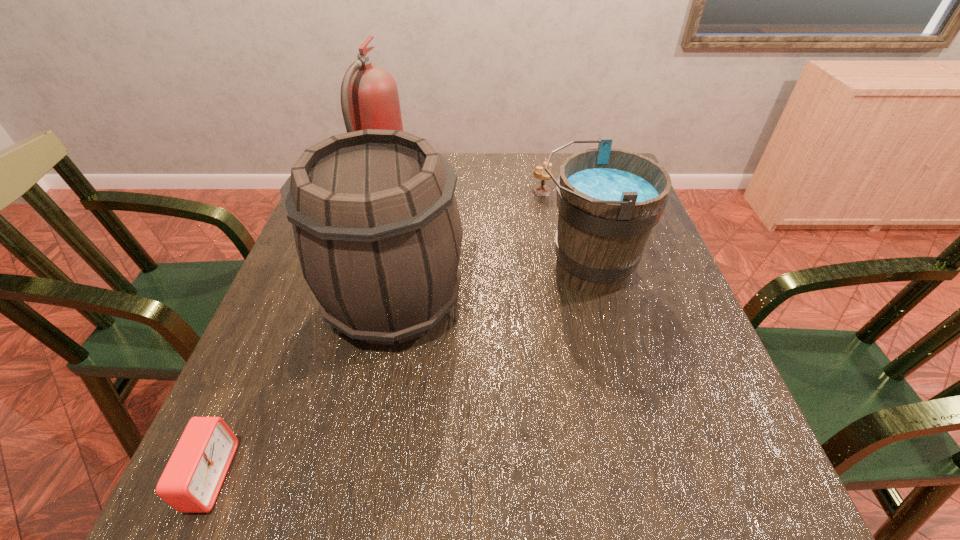
Where is `free space between the taller wine bucket and the shorter wine bucket`? Image resolution: width=960 pixels, height=540 pixels. free space between the taller wine bucket and the shorter wine bucket is located at coordinates (491, 285).

Image resolution: width=960 pixels, height=540 pixels. I want to click on vacant area between the fourth tallest object and the taller wine bucket, so click(468, 246).

Locate an element on the screen. The height and width of the screenshot is (540, 960). free point between the alarm clock and the fire extinguisher is located at coordinates (297, 332).

You are a GUI agent. You are given a task and a screenshot of the screen. Output one action in this format:
    pyautogui.click(x=<x>, y=<y>)
    Task: Click on the free area in between the right wine bucket and the alarm clock
    This screenshot has height=540, width=960.
    Given the screenshot: What is the action you would take?
    pyautogui.click(x=398, y=373)

Where is `free space between the leftmost object and the left wine bucket`? This screenshot has width=960, height=540. free space between the leftmost object and the left wine bucket is located at coordinates (302, 389).

Identify which object is the second closest to the fire extinguisher. Please provide its 2D coordinates. Your answer should be formatted as a tuple, i.e. [(x, y)], where the tuple contains the x and y coordinates of a point satisfying the conditions above.

[(609, 200)]

Identify which object is located as the fourth nearest to the fire extinguisher. Please provide its 2D coordinates. Your answer should be formatted as a tuple, i.e. [(x, y)], where the tuple contains the x and y coordinates of a point satisfying the conditions above.

[(190, 483)]

You are a GUI agent. You are given a task and a screenshot of the screen. Output one action in this format:
    pyautogui.click(x=<x>, y=<y>)
    Task: Click on the blank area in the image that satisfies the following two spatial constraints: 1. at the nozzle of the fourth tallest object; 2. on the left side of the fire extinguisher
    The width and height of the screenshot is (960, 540).
    Given the screenshot: What is the action you would take?
    pyautogui.click(x=382, y=191)

Identify the location of free spot that satisfies the following two spatial constraints: 1. on the back side of the left wine bucket; 2. at the nozzle of the fire extinguisher. This screenshot has width=960, height=540. (416, 188).

Find the location of a particular element. The height and width of the screenshot is (540, 960). free region that satisfies the following two spatial constraints: 1. on the back side of the left wine bucket; 2. at the nozzle of the fire extinguisher is located at coordinates (416, 188).